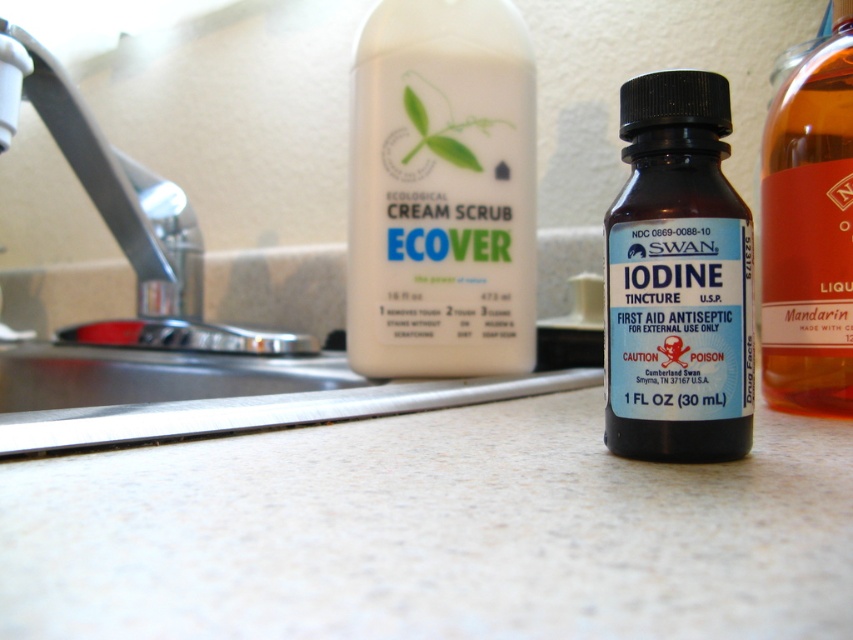
Question: Which of the following is the farthest from the observer?

Choices:
 (A) white matte cream scrub at center
 (B) matte black iodine tincture at center
 (C) silver metallic faucet at left
 (D) amber glass bottle at right

Answer: (A)

Question: Which of the following is the closest to the observer?

Choices:
 (A) white speckled laminate at center
 (B) amber glass bottle at right
 (C) silver metallic faucet at left
 (D) matte black iodine tincture at center

Answer: (A)

Question: Which of these objects is positioned closest to the matte black iodine tincture at center?

Choices:
 (A) white speckled laminate at center
 (B) amber glass bottle at right

Answer: (A)

Question: Is white speckled laminate at center wider than matte black iodine tincture at center?

Choices:
 (A) no
 (B) yes

Answer: (B)

Question: Can you confirm if white speckled laminate at center is wider than silver metallic faucet at left?

Choices:
 (A) yes
 (B) no

Answer: (A)

Question: Is white matte cream scrub at center wider than amber glass bottle at right?

Choices:
 (A) yes
 (B) no

Answer: (A)